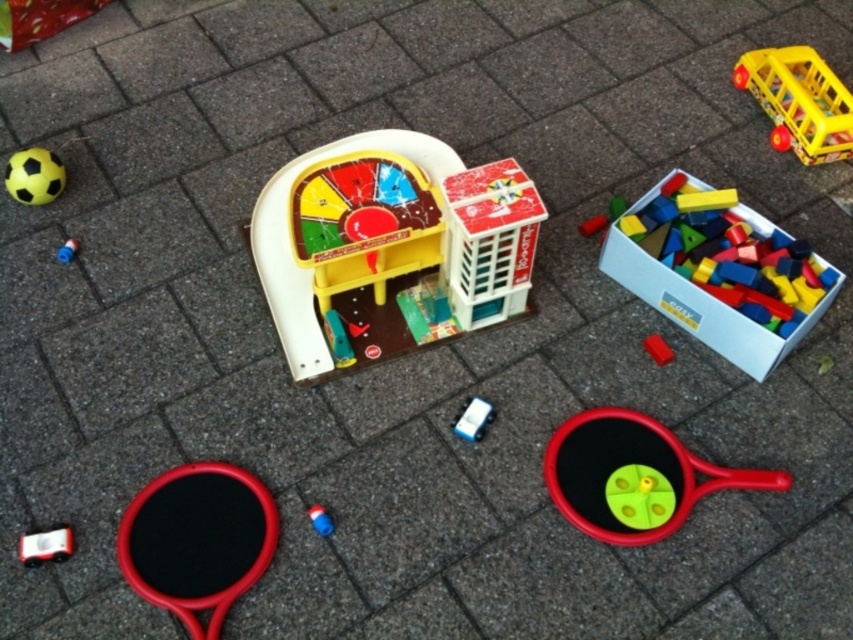
Is rubberized red tennis racket at lower center to the right of white plastic phone at center from the viewer's perspective?

Indeed, rubberized red tennis racket at lower center is positioned on the right side of white plastic phone at center.

Is point (579, 456) behind point (462, 417)?

No.

Identify the location of rubberized red tennis racket at lower center. This screenshot has width=853, height=640. (633, 476).

Does white plastic phone at center have a greater width compared to blue rubber toy at center?

Yes.

Who is positioned more to the left, white plastic phone at center or blue rubber toy at center?

blue rubber toy at center

The image size is (853, 640). What are the coordinates of `white plastic phone at center` in the screenshot? It's located at (473, 419).

Looking at this image, is yellow plastic toy bus at upper right to the right of white matte card at lower left from the viewer's perspective?

Indeed, yellow plastic toy bus at upper right is positioned on the right side of white matte card at lower left.

Between yellow plastic toy bus at upper right and white matte card at lower left, which one has less height?

With less height is white matte card at lower left.

Image resolution: width=853 pixels, height=640 pixels. I want to click on yellow plastic toy bus at upper right, so click(799, 100).

What are the coordinates of `yellow plastic toy bus at upper right` in the screenshot? It's located at (799, 100).